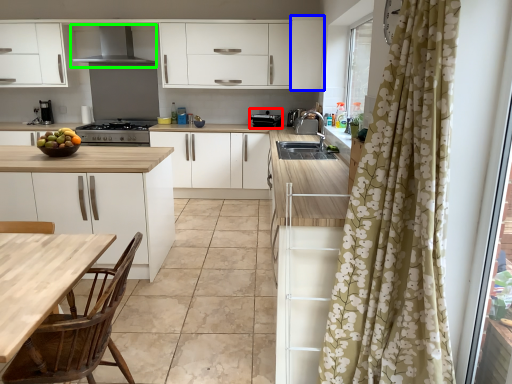
Question: Considering the real-world distances, which object is closest to appliance (highlighted by a red box)? cabinetry (highlighted by a blue box) or exhaust hood (highlighted by a green box).

Choices:
 (A) cabinetry
 (B) exhaust hood

Answer: (A)